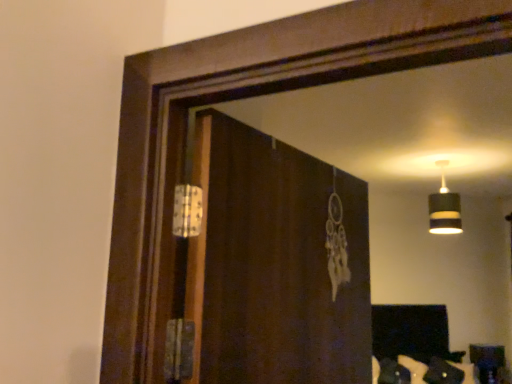
Describe the element at coordinates (276, 263) in the screenshot. The image size is (512, 384). I see `brown wooden screen door at center` at that location.

Identify the location of brown wooden screen door at center. (276, 263).

In the scene shown: In terms of height, does black striped lampshade at upper right look taller or shorter compared to brown wooden screen door at center?

Considering their sizes, black striped lampshade at upper right has less height than brown wooden screen door at center.

Is black striped lampshade at upper right bigger than brown wooden screen door at center?

No, black striped lampshade at upper right is not bigger than brown wooden screen door at center.

You are a GUI agent. You are given a task and a screenshot of the screen. Output one action in this format:
    pyautogui.click(x=<x>, y=<y>)
    Task: Click on the lamp on the right of brown wooden screen door at center
    The height and width of the screenshot is (384, 512).
    Given the screenshot: What is the action you would take?
    pyautogui.click(x=444, y=208)

Could you tell me if black striped lampshade at upper right is turned towards brown wooden screen door at center?

No, black striped lampshade at upper right is not facing towards brown wooden screen door at center.

Which of these two, brown wooden screen door at center or wooden table at lower right, is thinner?

Thinner between the two is brown wooden screen door at center.

Is wooden table at lower right inside brown wooden screen door at center?

No, wooden table at lower right is located outside of brown wooden screen door at center.

From a real-world perspective, is brown wooden screen door at center below wooden table at lower right?

No, from a real-world perspective, brown wooden screen door at center is not beneath wooden table at lower right.

Based on the photo, which object is wider, wooden table at lower right or brown wooden screen door at center?

Wider between the two is wooden table at lower right.

Is point (499, 382) positioned behind point (282, 204)?

That is True.

From a real-world perspective, is wooden table at lower right positioned under brown wooden screen door at center based on gravity?

Yes, from a real-world perspective, wooden table at lower right is below brown wooden screen door at center.

Is wooden table at lower right not close to brown wooden screen door at center?

Yes, wooden table at lower right and brown wooden screen door at center are located far from each other.

From a real-world perspective, which object stands above the other?

black striped lampshade at upper right.

In the scene shown: Can black striped lampshade at upper right be found inside brown wooden screen door at center?

No, black striped lampshade at upper right is not a part of brown wooden screen door at center.

Consider the image. Based on their sizes in the image, would you say brown wooden screen door at center is bigger or smaller than black striped lampshade at upper right?

brown wooden screen door at center is bigger than black striped lampshade at upper right.

Considering the relative sizes of brown wooden screen door at center and black striped lampshade at upper right in the image provided, is brown wooden screen door at center thinner than black striped lampshade at upper right?

Yes, brown wooden screen door at center is thinner than black striped lampshade at upper right.

Between black striped lampshade at upper right and wooden table at lower right, which one has larger width?

Wider between the two is black striped lampshade at upper right.

Which of these two, black striped lampshade at upper right or wooden table at lower right, is smaller?

wooden table at lower right is smaller.

In the scene shown: Can you confirm if black striped lampshade at upper right is shorter than wooden table at lower right?

No.

Identify the location of lamp located in front of the wooden table at lower right. Image resolution: width=512 pixels, height=384 pixels. (444, 208).

Is wooden table at lower right not close to black striped lampshade at upper right?

Yes, wooden table at lower right and black striped lampshade at upper right are located far from each other.

From the image's perspective, is wooden table at lower right above black striped lampshade at upper right?

No, from the image's perspective, wooden table at lower right is not over black striped lampshade at upper right.

Can we say wooden table at lower right lies outside black striped lampshade at upper right?

Yes, wooden table at lower right is outside of black striped lampshade at upper right.

Identify the location of screen door that is in front of the black striped lampshade at upper right. (276, 263).

Identify the location of screen door on the left side of wooden table at lower right. (276, 263).

Estimate the real-world distances between objects in this image. Which object is further from brown wooden screen door at center, wooden table at lower right or black striped lampshade at upper right?

The object further to brown wooden screen door at center is wooden table at lower right.

Estimate the real-world distances between objects in this image. Which object is further from black striped lampshade at upper right, brown wooden screen door at center or wooden table at lower right?

Based on the image, brown wooden screen door at center appears to be further to black striped lampshade at upper right.

Based on their spatial positions, is wooden table at lower right or brown wooden screen door at center further from black striped lampshade at upper right?

Among the two, brown wooden screen door at center is located further to black striped lampshade at upper right.

Considering their positions, is brown wooden screen door at center positioned closer to wooden table at lower right than black striped lampshade at upper right?

black striped lampshade at upper right is closer to wooden table at lower right.

Estimate the real-world distances between objects in this image. Which object is further from wooden table at lower right, black striped lampshade at upper right or brown wooden screen door at center?

The object further to wooden table at lower right is brown wooden screen door at center.

When comparing their distances from brown wooden screen door at center, does black striped lampshade at upper right or wooden table at lower right seem further?

wooden table at lower right lies further to brown wooden screen door at center than the other object.

Identify the location of lamp positioned between brown wooden screen door at center and wooden table at lower right from near to far. (444, 208).